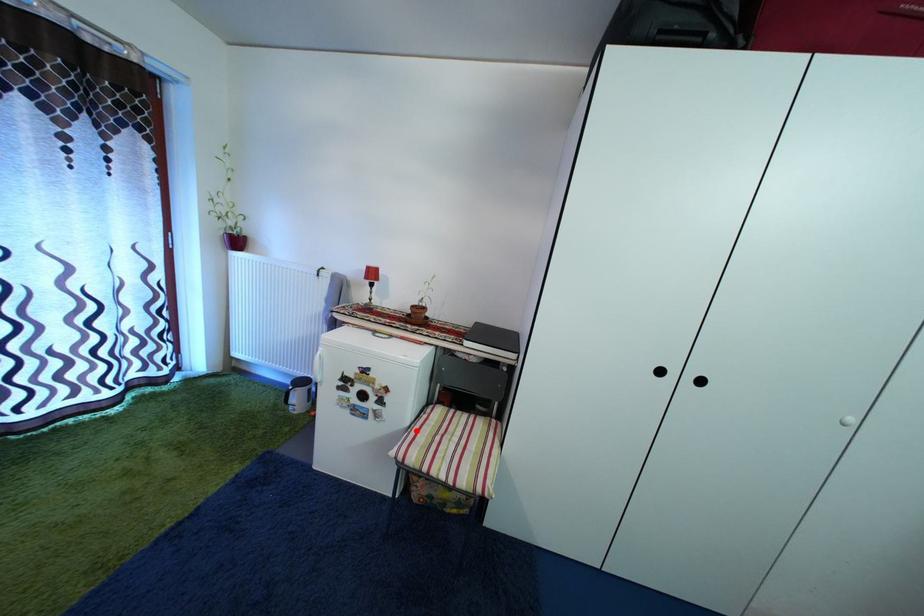
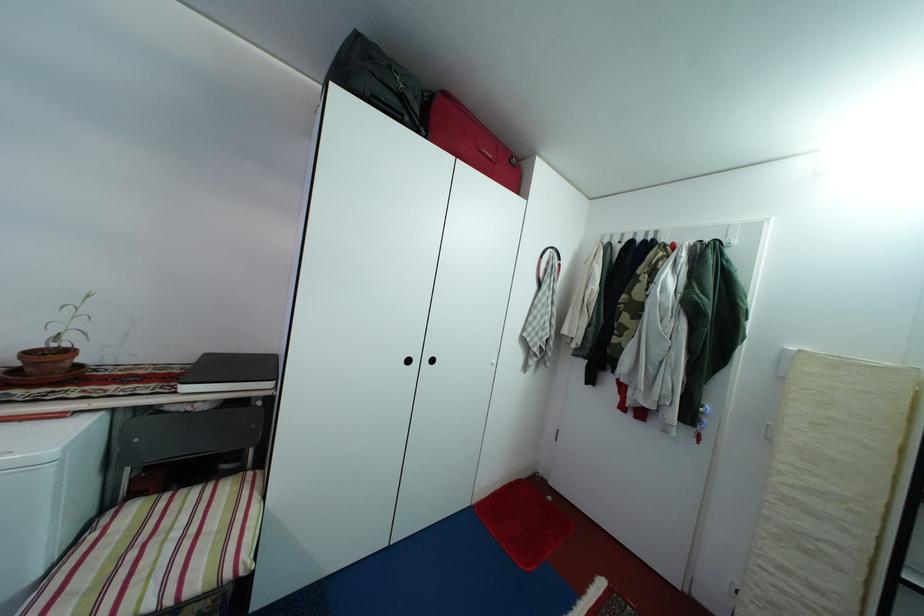
Question: I am providing you with two images of the same scene from different viewpoints. Image1 has a red point marked. In image2, the corresponding 3D location appears at what relative position? Reply with the corresponding letter.

Choices:
 (A) Closer
 (B) Farther

Answer: (A)